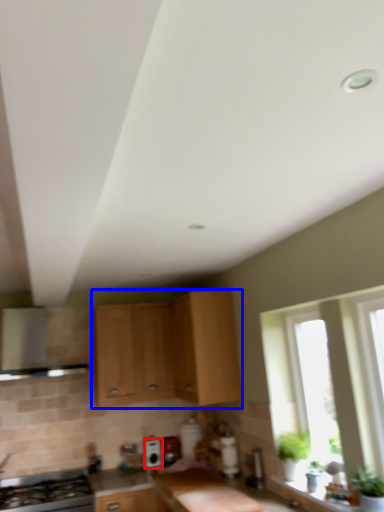
Question: Which object is closer to the camera taking this photo, appliance (highlighted by a red box) or cabinetry (highlighted by a blue box)?

Choices:
 (A) appliance
 (B) cabinetry

Answer: (B)